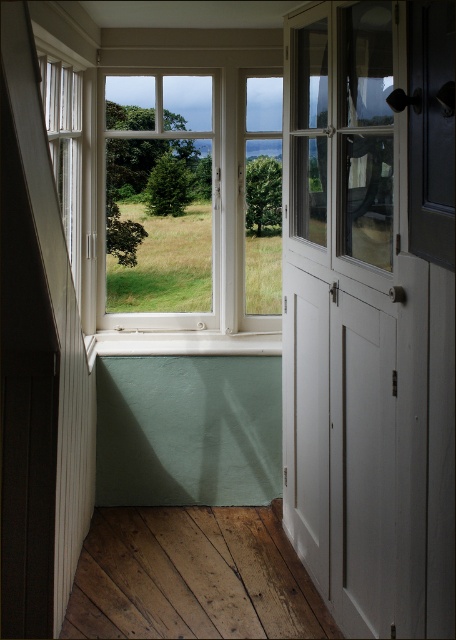
Between point (338, 470) and point (191, 332), which one is positioned behind?

The point (191, 332) is more distant.

Which of these two, white wood screen door at right or white painted wood at lower center, stands taller?

white wood screen door at right is taller.

Between point (301, 451) and point (184, 349), which one is positioned in front?

Point (301, 451)

I want to click on white wood screen door at right, so click(352, 321).

Is point (160, 241) positioned after point (212, 353)?

Yes, point (160, 241) is farther from viewer.

Is white wooden window at center to the left of white painted wood at lower center from the viewer's perspective?

Yes, white wooden window at center is to the left of white painted wood at lower center.

In order to click on white wooden window at center in this screenshot , I will do `click(160, 193)`.

You are a GUI agent. You are given a task and a screenshot of the screen. Output one action in this format:
    pyautogui.click(x=<x>, y=<y>)
    Task: Click on the white wooden window at center
    
    Given the screenshot: What is the action you would take?
    tap(160, 193)

Measure the distance between point (347, 544) and camera.

Point (347, 544) and camera are 9.18 feet apart.

Does white wood screen door at right have a greater height compared to white wooden window at center?

Correct, white wood screen door at right is much taller as white wooden window at center.

Does point (331, 435) come in front of point (107, 284)?

Yes, it is.

Identify the location of white wood screen door at right. This screenshot has height=640, width=456. (352, 321).